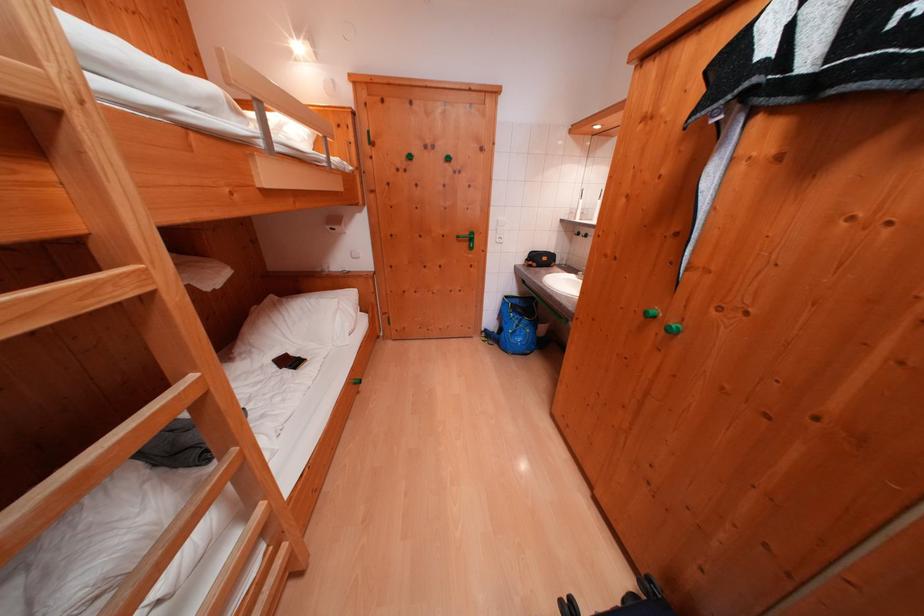
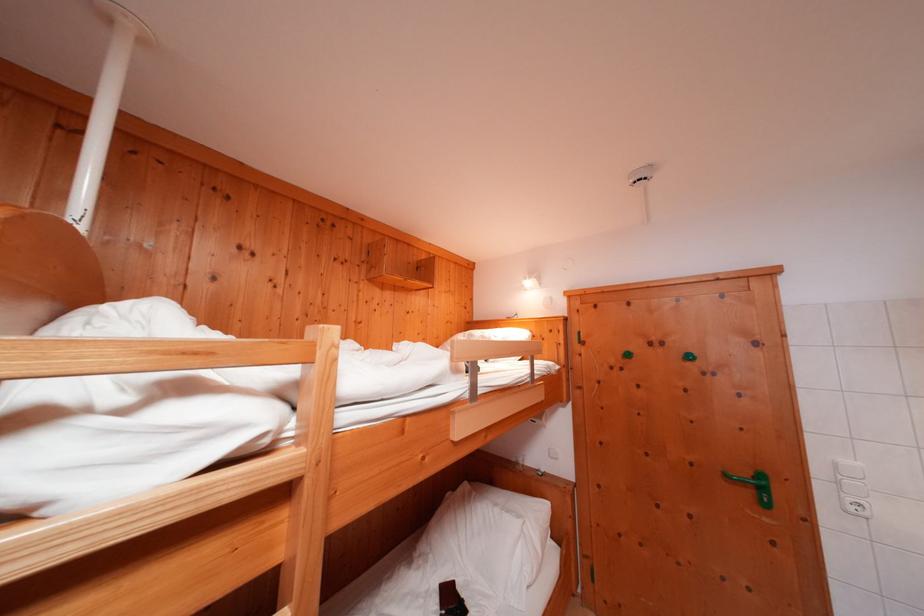
Locate, in the second image, the point that corresponds to [271,148] in the first image.

(476, 399)